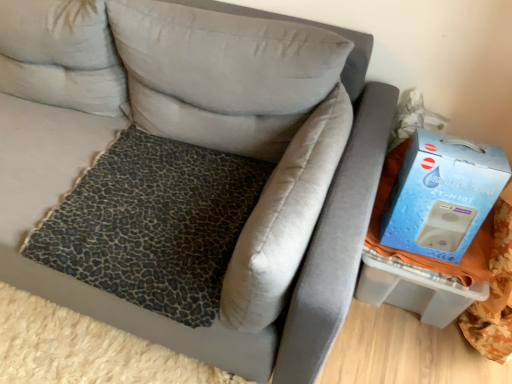
Question: Is blue cardboard box at right facing towards light gray fabric pillow at upper left, marked as the third pillow in a right-to-left arrangement?

Choices:
 (A) yes
 (B) no

Answer: (B)

Question: Is light gray fabric pillow at upper left, marked as the third pillow in a right-to-left arrangement, located within blue cardboard box at right?

Choices:
 (A) no
 (B) yes

Answer: (A)

Question: From the image's perspective, is blue cardboard box at right below light gray fabric pillow at upper left, acting as the first pillow starting from the left?

Choices:
 (A) no
 (B) yes

Answer: (B)

Question: Does blue cardboard box at right appear on the right side of light gray fabric pillow at upper left, acting as the first pillow starting from the left?

Choices:
 (A) no
 (B) yes

Answer: (B)

Question: From the image's perspective, is blue cardboard box at right over light gray fabric pillow at upper left, marked as the third pillow in a right-to-left arrangement?

Choices:
 (A) no
 (B) yes

Answer: (A)

Question: Considering the positions of leopard print fabric at center and light gray fabric pillow at upper left, marked as the third pillow in a right-to-left arrangement, in the image, is leopard print fabric at center bigger or smaller than light gray fabric pillow at upper left, marked as the third pillow in a right-to-left arrangement,?

Choices:
 (A) small
 (B) big

Answer: (A)

Question: Is leopard print fabric at center taller or shorter than light gray fabric pillow at upper left, marked as the third pillow in a right-to-left arrangement?

Choices:
 (A) tall
 (B) short

Answer: (B)

Question: Considering the positions of leopard print fabric at center and light gray fabric pillow at upper left, acting as the first pillow starting from the left, in the image, is leopard print fabric at center wider or thinner than light gray fabric pillow at upper left, acting as the first pillow starting from the left,?

Choices:
 (A) wide
 (B) thin

Answer: (A)

Question: Relative to light gray fabric pillow at upper left, marked as the third pillow in a right-to-left arrangement, is leopard print fabric at center in front or behind?

Choices:
 (A) front
 (B) behind

Answer: (A)

Question: Considering the positions of light gray fabric pillow at upper left, acting as the first pillow starting from the left, and leopard print fabric pillow at center, the 3th pillow when ordered from left to right, in the image, is light gray fabric pillow at upper left, acting as the first pillow starting from the left, bigger or smaller than leopard print fabric pillow at center, the 3th pillow when ordered from left to right,?

Choices:
 (A) big
 (B) small

Answer: (A)

Question: From the image's perspective, is light gray fabric pillow at upper left, acting as the first pillow starting from the left, above or below leopard print fabric pillow at center, the 1th pillow from the right?

Choices:
 (A) above
 (B) below

Answer: (A)

Question: In terms of height, does light gray fabric pillow at upper left, marked as the third pillow in a right-to-left arrangement, look taller or shorter compared to leopard print fabric pillow at center, the 1th pillow from the right?

Choices:
 (A) short
 (B) tall

Answer: (B)

Question: Relative to leopard print fabric pillow at center, the 1th pillow from the right, is light gray fabric pillow at upper left, acting as the first pillow starting from the left, in front or behind?

Choices:
 (A) front
 (B) behind

Answer: (B)

Question: Is point (233, 269) closer or farther from the camera than point (462, 140)?

Choices:
 (A) farther
 (B) closer

Answer: (B)

Question: In terms of height, does leopard print fabric pillow at center, the 1th pillow from the right, look taller or shorter compared to blue cardboard box at right?

Choices:
 (A) short
 (B) tall

Answer: (B)